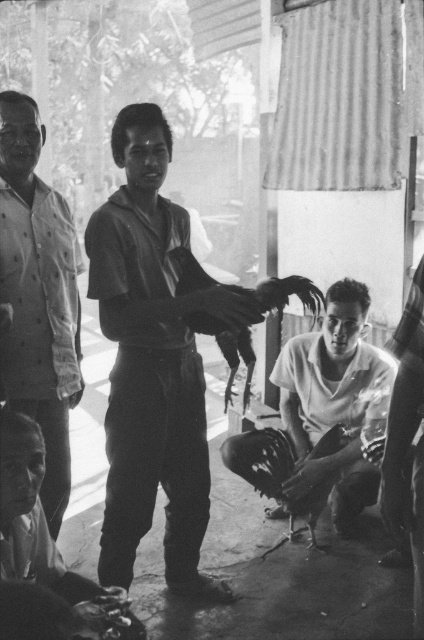
Does smooth black shirt at center appear on the right side of smooth white shirt at center?

No, smooth black shirt at center is not to the right of smooth white shirt at center.

Is smooth black shirt at center taller than smooth white shirt at center?

Yes.

Which is in front, point (176, 387) or point (388, 369)?

Positioned in front is point (176, 387).

You are a GUI agent. You are given a task and a screenshot of the screen. Output one action in this format:
    pyautogui.click(x=<x>, y=<y>)
    Task: Click on the smooth black shirt at center
    The image size is (424, 640).
    Given the screenshot: What is the action you would take?
    point(150,364)

Is light gray button-up shirt at left further to the viewer compared to smooth white shirt at center?

No, light gray button-up shirt at left is closer to the viewer.

Which is above, light gray button-up shirt at left or smooth white shirt at center?

light gray button-up shirt at left is above.

The width and height of the screenshot is (424, 640). In order to click on light gray button-up shirt at left in this screenshot , I will do (x=39, y=296).

Between smooth black shirt at center and light gray button-up shirt at left, which one is positioned higher?

light gray button-up shirt at left

Looking at this image, is smooth black shirt at center positioned in front of light gray button-up shirt at left?

That is True.

Between point (144, 333) and point (13, 184), which one is positioned in front?

Positioned in front is point (144, 333).

At what (x,y) coordinates should I click in order to perform the action: click on smooth black shirt at center. Please return your answer as a coordinate pair (x, y). This screenshot has width=424, height=640. Looking at the image, I should click on (150, 364).